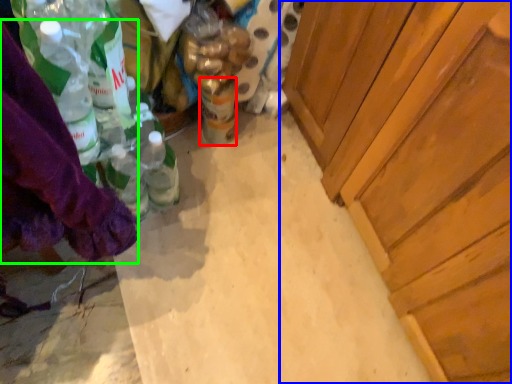
Question: Which object is positioned farthest from beverage (highlighted by a red box)? Select from cabinetry (highlighted by a blue box) and clothing (highlighted by a green box).

Choices:
 (A) cabinetry
 (B) clothing

Answer: (B)